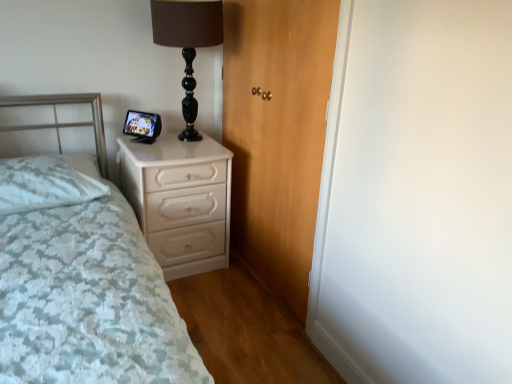
Find the location of a particular element. free point in front of wooden door at center is located at coordinates (245, 320).